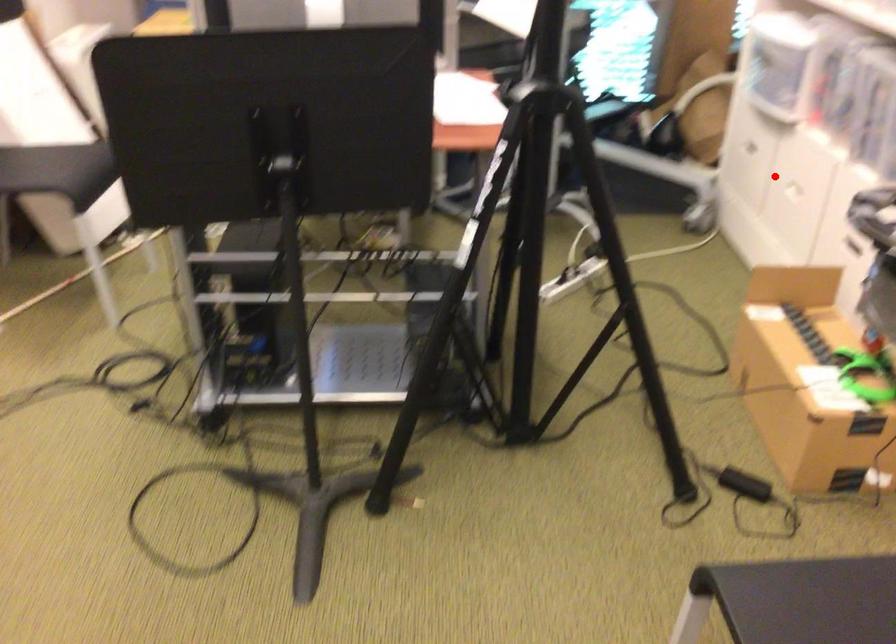
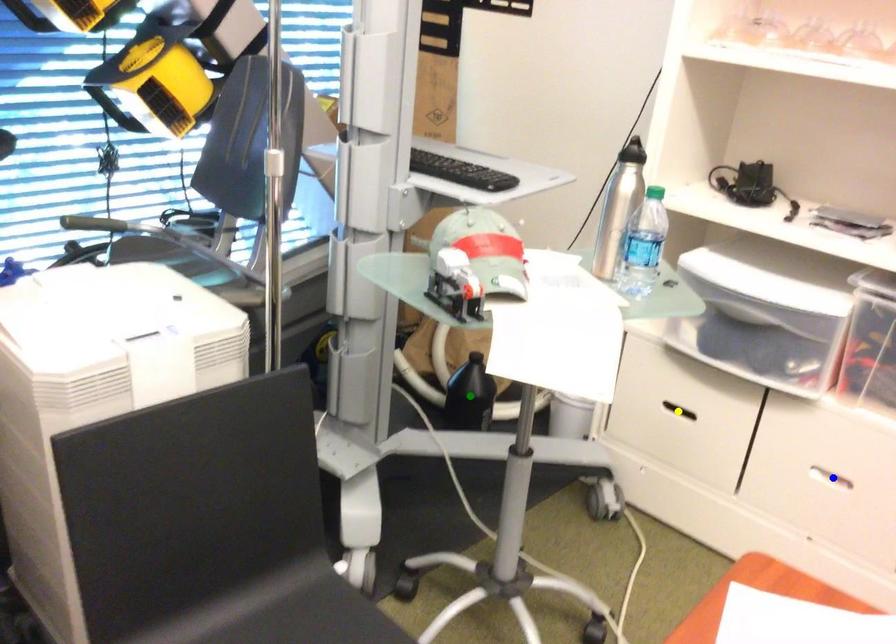
Question: I am providing you with two images of the same scene from different viewpoints. A red point is marked on the first image. You are given multiple points on the second image. Which mark in image 2 goes with the point in image 1?

Choices:
 (A) yellow point
 (B) green point
 (C) blue point

Answer: (C)